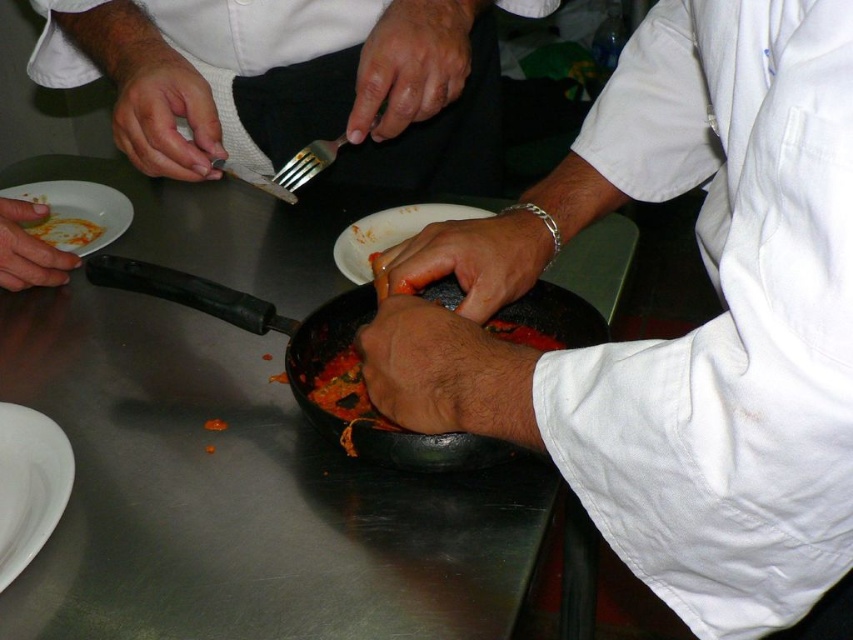
Is black matte wok at center smaller than silver metallic fork at center?

Actually, black matte wok at center might be larger than silver metallic fork at center.

Is point (202, 291) farther from viewer compared to point (320, 170)?

No.

This screenshot has width=853, height=640. Identify the location of black matte wok at center. (253, 320).

Between point (422, 90) and point (180, 70), which one is positioned behind?

Positioned behind is point (180, 70).

At what (x,y) coordinates should I click in order to perform the action: click on smooth black fork at center. Please return your answer as a coordinate pair (x, y). The width and height of the screenshot is (853, 640). Looking at the image, I should click on (410, 65).

This screenshot has height=640, width=853. What do you see at coordinates (410, 65) in the screenshot? I see `smooth black fork at center` at bounding box center [410, 65].

Identify the location of smooth black fork at center. The height and width of the screenshot is (640, 853). (410, 65).

Is smooth gray glove at center further to camera compared to matte silver fork at upper left?

No, it is not.

Which is in front, point (527, 246) or point (167, 118)?

Point (527, 246) is more forward.

At what (x,y) coordinates should I click in order to perform the action: click on smooth gray glove at center. Please return your answer as a coordinate pair (x, y). The width and height of the screenshot is (853, 640). Looking at the image, I should click on (469, 259).